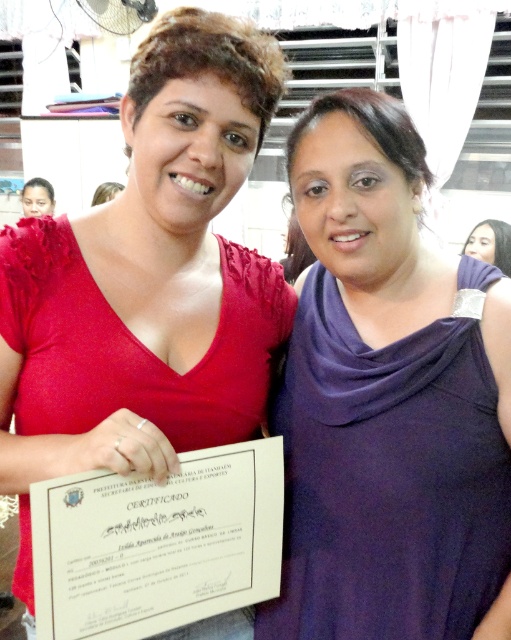
Looking at this image, is matte red dress at center positioned before white paper certificate at center?

No, matte red dress at center is behind white paper certificate at center.

Can you confirm if matte red dress at center is shorter than white paper certificate at center?

No.

Does point (96, 300) come closer to viewer compared to point (108, 563)?

No.

The image size is (511, 640). In order to click on matte red dress at center in this screenshot , I will do `click(147, 280)`.

Between white paper certificate at center and purple matte scarf at upper right, which one is positioned lower?

white paper certificate at center is lower down.

Between white paper certificate at center and purple matte scarf at upper right, which one appears on the right side from the viewer's perspective?

purple matte scarf at upper right

Find the location of a particular element. Image resolution: width=511 pixels, height=640 pixels. white paper certificate at center is located at coordinates (157, 544).

Is purple matte dress at center taller than white paper certificate at center?

Correct, purple matte dress at center is much taller as white paper certificate at center.

Which is more to the right, purple matte dress at center or white paper certificate at center?

purple matte dress at center is more to the right.

Between point (312, 442) and point (113, 582), which one is positioned in front?

Point (113, 582) is more forward.

This screenshot has width=511, height=640. What are the coordinates of `purple matte dress at center` in the screenshot? It's located at (386, 400).